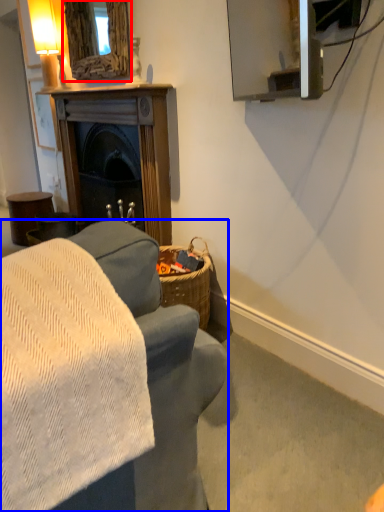
Question: Among these objects, which one is farthest to the camera, mirror (highlighted by a red box) or studio couch (highlighted by a blue box)?

Choices:
 (A) mirror
 (B) studio couch

Answer: (A)